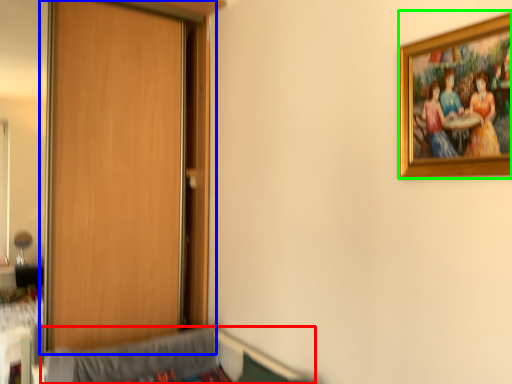
Question: Considering the real-world distances, which object is farthest from hospital bed (highlighted by a red box)? door (highlighted by a blue box) or picture frame (highlighted by a green box)?

Choices:
 (A) door
 (B) picture frame

Answer: (B)